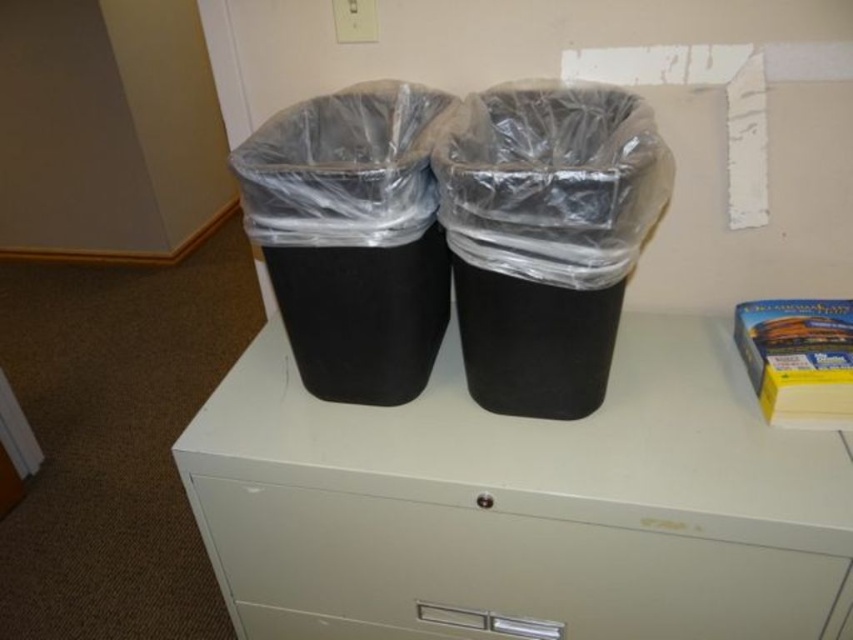
You are standing in front of the two black trash bins on the filing cabinet. You notice two points marked on the wall behind them. Which point, point at (485, 454) or point at (792, 378), is closer to you?

Point at (792, 378) is closer to you because it is in front of point at (485, 454).

You are organizing items in an office and need to place a new document. You have a white matte drawer at center and a yellow cardboard box at upper right. Which one is located to the left of the other?

The white matte drawer at center is positioned on the left side of yellow cardboard box at upper right.